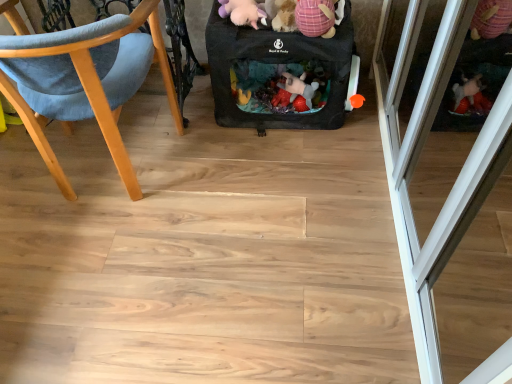
Question: Considering the relative positions of black fabric baby carriage at center and pink plaid fabric stuffed animal at upper center, positioned as the first toy in right-to-left order, in the image provided, is black fabric baby carriage at center to the right of pink plaid fabric stuffed animal at upper center, positioned as the first toy in right-to-left order, from the viewer's perspective?

Choices:
 (A) no
 (B) yes

Answer: (A)

Question: Considering the relative sizes of black fabric baby carriage at center and pink plaid fabric stuffed animal at upper center, positioned as the first toy in right-to-left order, in the image provided, is black fabric baby carriage at center wider than pink plaid fabric stuffed animal at upper center, positioned as the first toy in right-to-left order,?

Choices:
 (A) yes
 (B) no

Answer: (A)

Question: Is black fabric baby carriage at center aimed at pink plaid fabric stuffed animal at upper center, the second toy viewed from the left?

Choices:
 (A) no
 (B) yes

Answer: (A)

Question: Is the surface of black fabric baby carriage at center in direct contact with pink plaid fabric stuffed animal at upper center, positioned as the first toy in right-to-left order?

Choices:
 (A) yes
 (B) no

Answer: (B)

Question: Considering the relative sizes of black fabric baby carriage at center and pink plaid fabric stuffed animal at upper center, positioned as the first toy in right-to-left order, in the image provided, is black fabric baby carriage at center bigger than pink plaid fabric stuffed animal at upper center, positioned as the first toy in right-to-left order,?

Choices:
 (A) no
 (B) yes

Answer: (B)

Question: Is point (416, 122) closer or farther from the camera than point (60, 86)?

Choices:
 (A) farther
 (B) closer

Answer: (A)

Question: In terms of height, does transparent glass screen door at right look taller or shorter compared to wooden chair at left?

Choices:
 (A) short
 (B) tall

Answer: (B)

Question: In the image, is transparent glass screen door at right positioned in front of or behind wooden chair at left?

Choices:
 (A) behind
 (B) front

Answer: (B)

Question: Looking at their shapes, would you say transparent glass screen door at right is wider or thinner than wooden chair at left?

Choices:
 (A) wide
 (B) thin

Answer: (B)

Question: Relative to pink plaid fabric stuffed animal at upper center, the second toy viewed from the left, is transparent glass screen door at right in front or behind?

Choices:
 (A) behind
 (B) front

Answer: (B)

Question: From the image's perspective, is transparent glass screen door at right located above or below pink plaid fabric stuffed animal at upper center, positioned as the first toy in right-to-left order?

Choices:
 (A) below
 (B) above

Answer: (A)

Question: Considering the positions of transparent glass screen door at right and pink plaid fabric stuffed animal at upper center, positioned as the first toy in right-to-left order, in the image, is transparent glass screen door at right bigger or smaller than pink plaid fabric stuffed animal at upper center, positioned as the first toy in right-to-left order,?

Choices:
 (A) big
 (B) small

Answer: (A)

Question: In terms of height, does transparent glass screen door at right look taller or shorter compared to pink plaid fabric stuffed animal at upper center, the second toy viewed from the left?

Choices:
 (A) short
 (B) tall

Answer: (B)

Question: Is point (337, 59) closer or farther from the camera than point (316, 21)?

Choices:
 (A) closer
 (B) farther

Answer: (B)

Question: Would you say black fabric baby carriage at center is to the left or to the right of pink plaid fabric stuffed animal at upper center, positioned as the first toy in right-to-left order, in the picture?

Choices:
 (A) left
 (B) right

Answer: (A)